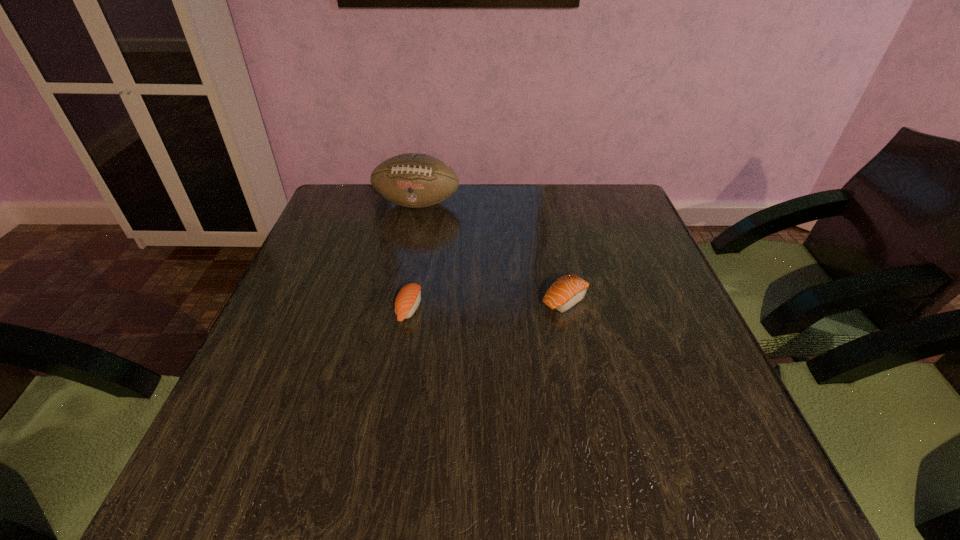
Find the location of `vacant area at the far edge`. vacant area at the far edge is located at coordinates (395, 219).

This screenshot has height=540, width=960. What are the coordinates of `free space at the left edge` in the screenshot? It's located at (316, 305).

I want to click on blank area at the right edge, so point(656,291).

Identify the location of free space at the far left corner of the desktop. This screenshot has width=960, height=540. (333, 197).

Find the location of a particular element. Image resolution: width=960 pixels, height=540 pixels. free space between the left sushi and the rightmost object is located at coordinates (487, 304).

The height and width of the screenshot is (540, 960). Identify the location of free spot between the tallest object and the right sushi. (492, 252).

Identify the location of free space that is in between the left sushi and the farthest object. The height and width of the screenshot is (540, 960). (413, 256).

At what (x,y) coordinates should I click in order to perform the action: click on empty space between the left sushi and the tallest object. Please return your answer as a coordinate pair (x, y). The height and width of the screenshot is (540, 960). Looking at the image, I should click on (413, 256).

Locate an element on the screen. The image size is (960, 540). free space between the left sushi and the rightmost object is located at coordinates (487, 304).

Image resolution: width=960 pixels, height=540 pixels. In order to click on vacant space that's between the farthest object and the right sushi in this screenshot , I will do `click(492, 252)`.